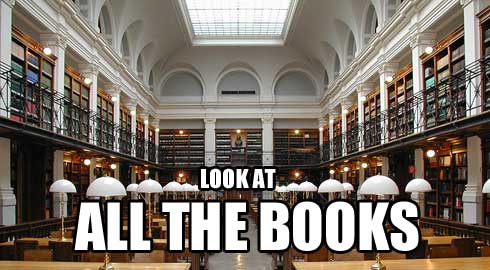
At what (x,y) coordinates should I click in order to perform the action: click on black horizontal line on upper wall. Please return your answer as a coordinate pair (x, y). Looking at the image, I should click on (240, 91).